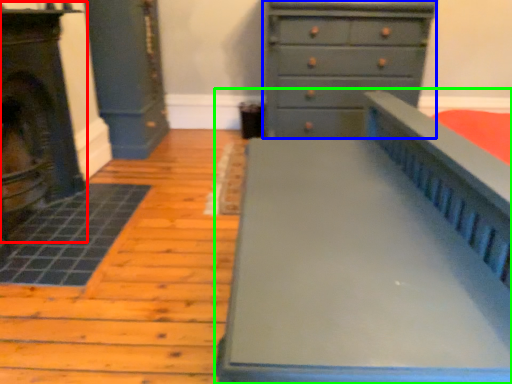
Question: Considering the real-world distances, which object is farthest from fireplace (highlighted by a red box)? chest of drawers (highlighted by a blue box) or furniture (highlighted by a green box)?

Choices:
 (A) chest of drawers
 (B) furniture

Answer: (A)